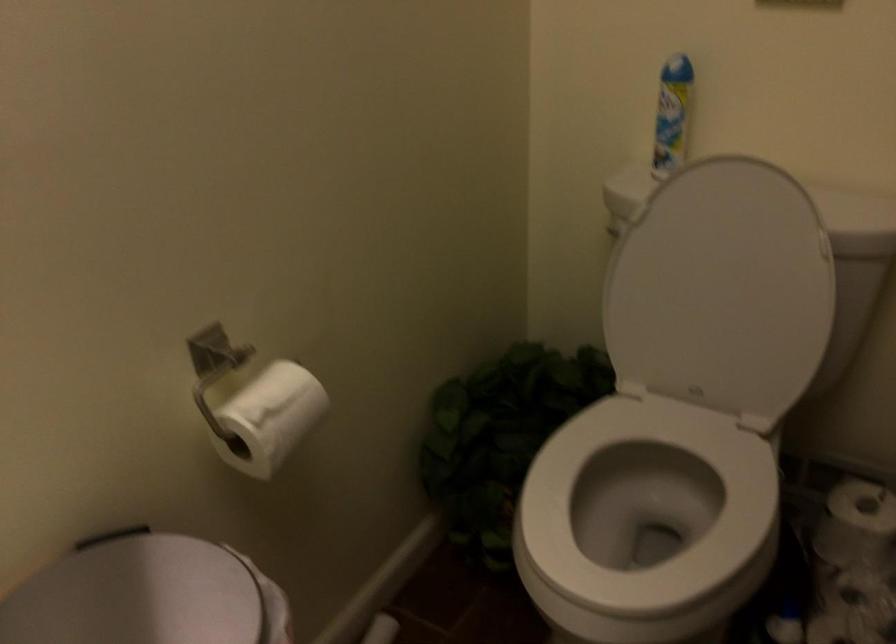
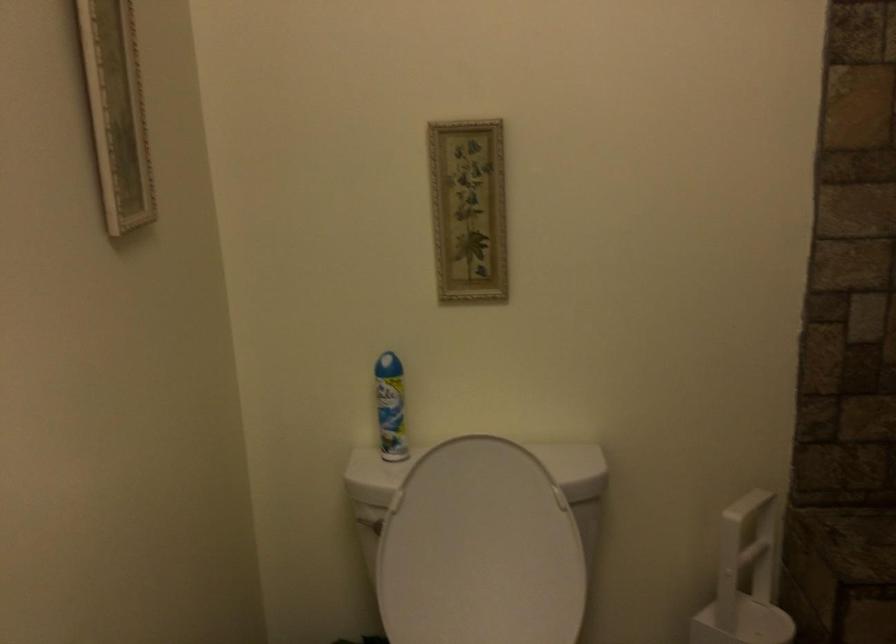
Where in the second image is the point corresponding to pixel 718 281 from the first image?

(479, 550)